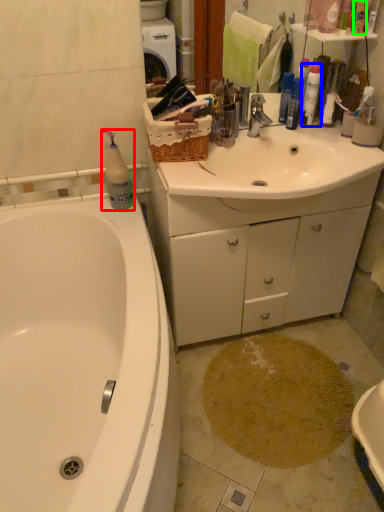
Question: Which object is positioned farthest from cleaning product (highlighted by a red box)? Select from cleaning product (highlighted by a blue box) and toiletry (highlighted by a green box).

Choices:
 (A) cleaning product
 (B) toiletry

Answer: (B)